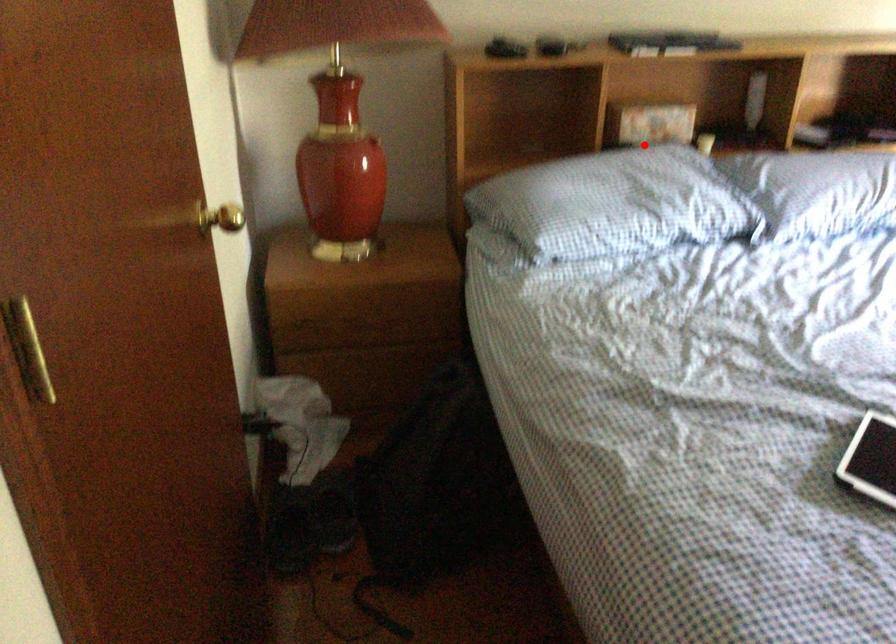
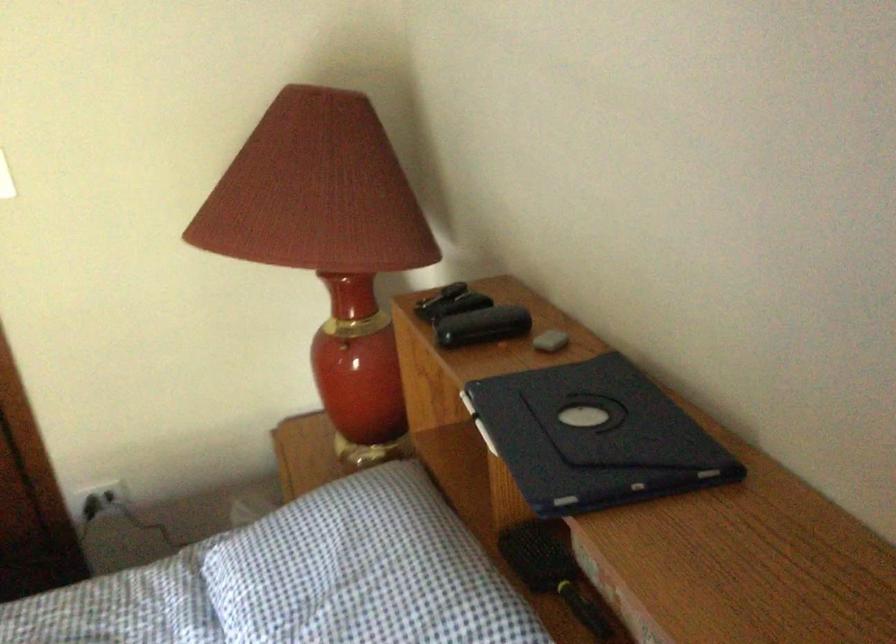
Find the pixel in the second image that matches the highlighted location in the first image.

(552, 571)